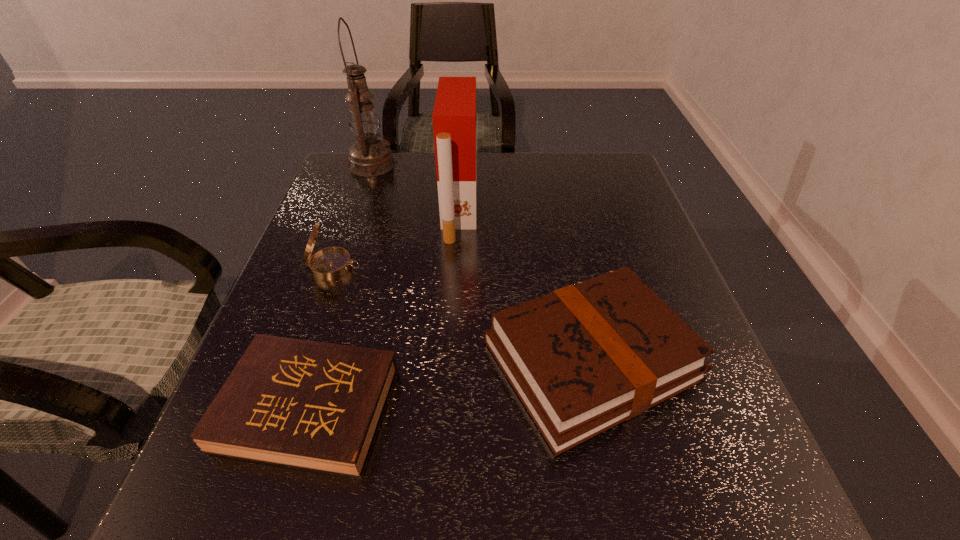
Locate an element on the screen. vacant space that is in between the right hardback book and the second farthest object is located at coordinates (525, 285).

Where is `free space between the taller hardback book and the third farthest object`? The width and height of the screenshot is (960, 540). free space between the taller hardback book and the third farthest object is located at coordinates (463, 313).

Locate an element on the screen. Image resolution: width=960 pixels, height=540 pixels. vacant region between the third tallest object and the farthest object is located at coordinates (353, 215).

Find the location of `unoccupied area between the fourth shortest object and the oil lamp`. unoccupied area between the fourth shortest object and the oil lamp is located at coordinates (416, 187).

Locate an element on the screen. This screenshot has height=540, width=960. free point between the farthest object and the cigarette case is located at coordinates (416, 187).

You are a GUI agent. You are given a task and a screenshot of the screen. Output one action in this format:
    pyautogui.click(x=<x>, y=<y>)
    Task: Click on the vacant point located between the shorter hardback book and the second object from right to left
    Image resolution: width=960 pixels, height=540 pixels.
    Given the screenshot: What is the action you would take?
    pyautogui.click(x=384, y=310)

You are a GUI agent. You are given a task and a screenshot of the screen. Output one action in this format:
    pyautogui.click(x=<x>, y=<y>)
    Task: Click on the free space between the second tallest object and the third farthest object
    The width and height of the screenshot is (960, 540).
    Given the screenshot: What is the action you would take?
    pyautogui.click(x=396, y=239)

The image size is (960, 540). Find the location of `vacant space that's between the rightmost object and the oil lamp`. vacant space that's between the rightmost object and the oil lamp is located at coordinates pyautogui.click(x=481, y=262).

At what (x,y) coordinates should I click in order to perform the action: click on vacant area that lies between the cigarette case and the farthest object. Please return your answer as a coordinate pair (x, y). Looking at the image, I should click on (416, 187).

Choose which object is the third nearest neighbor to the oil lamp. Please provide its 2D coordinates. Your answer should be formatted as a tuple, i.e. [(x, y)], where the tuple contains the x and y coordinates of a point satisfying the conditions above.

[(584, 358)]